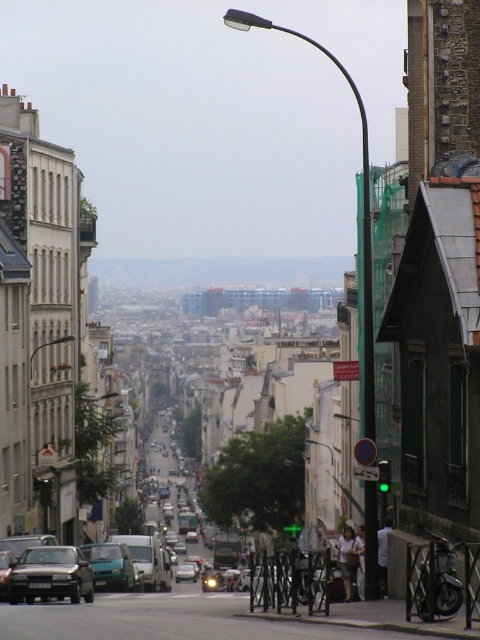
Question: Which object appears farthest from the camera in this image?

Choices:
 (A) black matte car at center
 (B) silver metallic car at center
 (C) teal matte van at center

Answer: (B)

Question: Which point is closer to the camera?

Choices:
 (A) (192, 563)
 (B) (124, 588)

Answer: (B)

Question: Is black matte car at center wider than silver metallic car at center?

Choices:
 (A) no
 (B) yes

Answer: (B)

Question: Which point is farther to the camera?

Choices:
 (A) teal matte van at center
 (B) black matte car at center
 (C) silver metallic car at center

Answer: (C)

Question: Is teal matte van at center thinner than silver metallic car at center?

Choices:
 (A) yes
 (B) no

Answer: (B)

Question: Is black matte car at center to the left of teal matte van at center from the viewer's perspective?

Choices:
 (A) yes
 (B) no

Answer: (A)